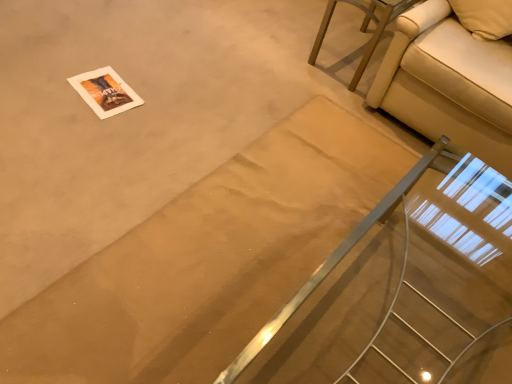
Question: Is beige fabric couch at upper right further to camera compared to clear glass stairs at center?

Choices:
 (A) no
 (B) yes

Answer: (B)

Question: Does beige fabric couch at upper right lie in front of clear glass stairs at center?

Choices:
 (A) yes
 (B) no

Answer: (B)

Question: From a real-world perspective, is beige fabric couch at upper right located beneath clear glass stairs at center?

Choices:
 (A) no
 (B) yes

Answer: (B)

Question: Considering the relative sizes of beige fabric couch at upper right and clear glass stairs at center in the image provided, is beige fabric couch at upper right taller than clear glass stairs at center?

Choices:
 (A) yes
 (B) no

Answer: (B)

Question: Does beige fabric couch at upper right have a smaller size compared to clear glass stairs at center?

Choices:
 (A) no
 (B) yes

Answer: (B)

Question: Is beige fabric couch at upper right not inside clear glass stairs at center?

Choices:
 (A) no
 (B) yes

Answer: (B)

Question: Is beige fabric couch at upper right wider than beige fabric couch at upper right?

Choices:
 (A) yes
 (B) no

Answer: (A)

Question: Is beige fabric couch at upper right further to camera compared to beige fabric couch at upper right?

Choices:
 (A) yes
 (B) no

Answer: (B)

Question: From the image's perspective, would you say beige fabric couch at upper right is positioned over beige fabric couch at upper right?

Choices:
 (A) no
 (B) yes

Answer: (A)

Question: Is beige fabric couch at upper right with beige fabric couch at upper right?

Choices:
 (A) yes
 (B) no

Answer: (B)

Question: From a real-world perspective, is beige fabric couch at upper right physically above beige fabric couch at upper right?

Choices:
 (A) yes
 (B) no

Answer: (A)

Question: Is beige fabric couch at upper right shorter than beige fabric couch at upper right?

Choices:
 (A) no
 (B) yes

Answer: (A)

Question: Is the depth of clear glass stairs at center greater than that of beige fabric couch at upper right?

Choices:
 (A) no
 (B) yes

Answer: (A)